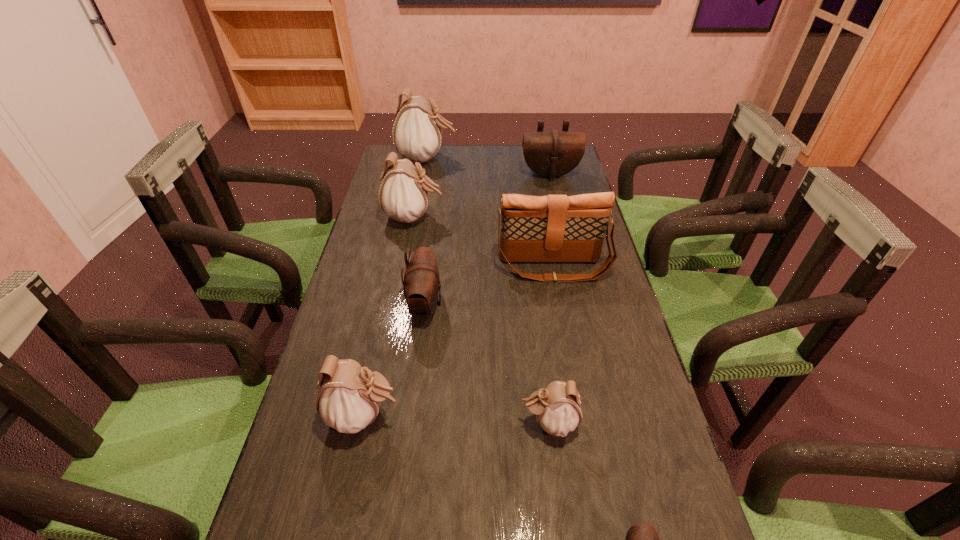
The image size is (960, 540). Find the location of `the second closest brown pouch relative to the shoulder bag`. the second closest brown pouch relative to the shoulder bag is located at coordinates (551, 154).

The height and width of the screenshot is (540, 960). In order to click on vacant space that satisfies the following two spatial constraints: 1. with the flap open on the biggest brown pouch; 2. on the front-facing side of the third biggest white pouch in this screenshot , I will do `click(605, 415)`.